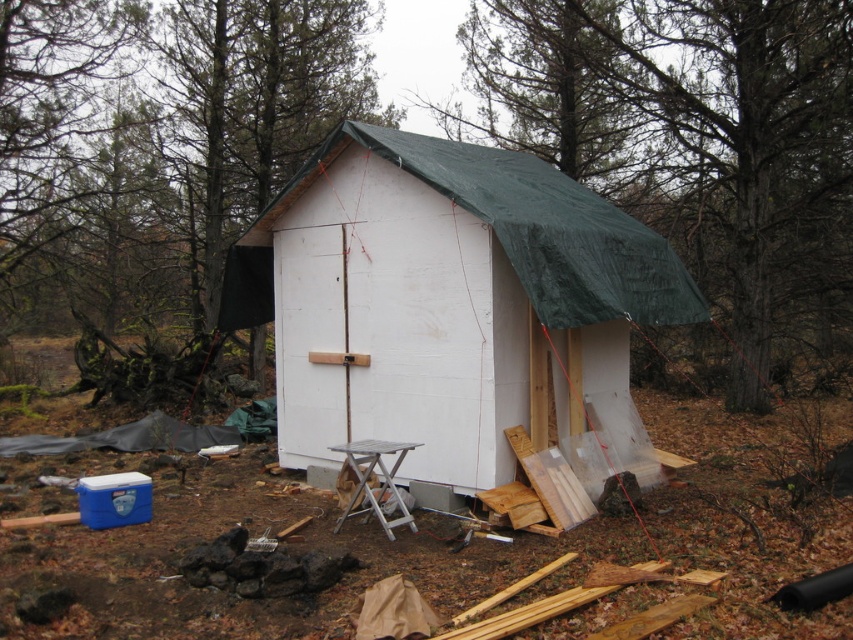
Can you confirm if white painted wood hut at center is bigger than silver metallic stool at lower center?

Yes, white painted wood hut at center is bigger than silver metallic stool at lower center.

Does point (631, 262) come behind point (347, 461)?

That is True.

Does point (373, 401) come closer to viewer compared to point (361, 492)?

No, (373, 401) is further to viewer.

This screenshot has height=640, width=853. I want to click on white painted wood hut at center, so click(444, 298).